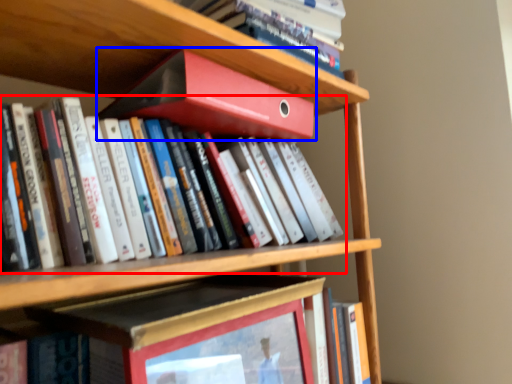
Question: Which object appears farthest to the camera in this image, book (highlighted by a red box) or book (highlighted by a blue box)?

Choices:
 (A) book
 (B) book

Answer: (B)